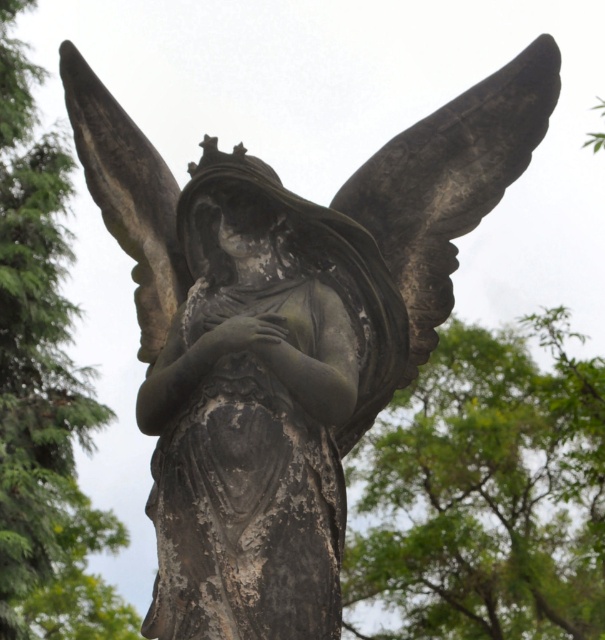
You are standing in front of the stone angel statue and notice both the green leafy tree at upper left and the dark gray stone wing at upper left. Which object is closer to you?

The green leafy tree at upper left is closer to you because it is further to the viewer than the dark gray stone wing at upper left.